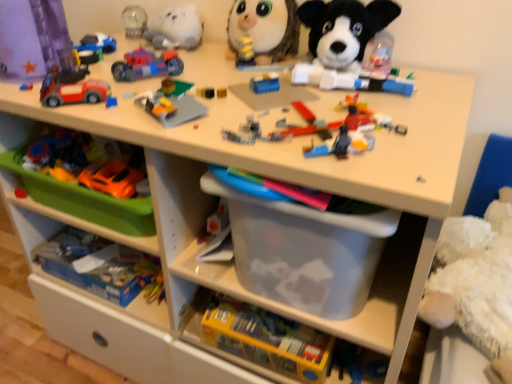
At what (x,y) coordinates should I click in order to perform the action: click on vacant space to the right of translucent plastic bricks at center, arranged as the 6th toy when viewed from the top. Please return your answer as a coordinate pair (x, y). This screenshot has width=512, height=384. Looking at the image, I should click on (425, 114).